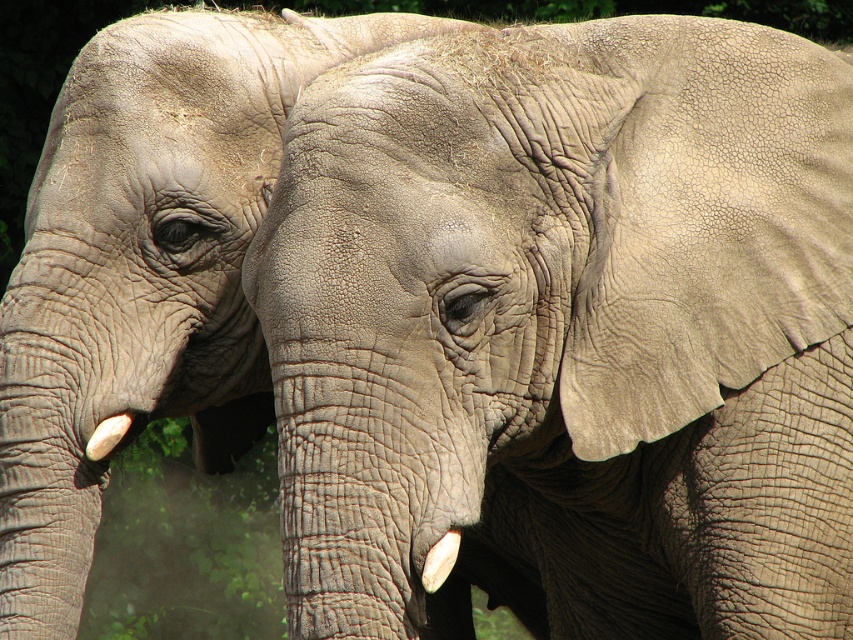
Question: Which point appears closest to the camera in this image?

Choices:
 (A) (x=436, y=557)
 (B) (x=103, y=449)

Answer: (A)

Question: Which point is closer to the camera taking this photo?

Choices:
 (A) (119, 429)
 (B) (433, 577)

Answer: (B)

Question: Which of the following is the closest to the observer?

Choices:
 (A) (450, 560)
 (B) (354, 131)

Answer: (A)

Question: Can you confirm if white matte tusk at lower center is wider than white ivory tusk at lower left?

Choices:
 (A) no
 (B) yes

Answer: (A)

Question: Does gray textured elephant at center have a larger size compared to white matte tusk at lower center?

Choices:
 (A) yes
 (B) no

Answer: (A)

Question: Is gray textured elephant at center bigger than white matte tusk at lower center?

Choices:
 (A) no
 (B) yes

Answer: (B)